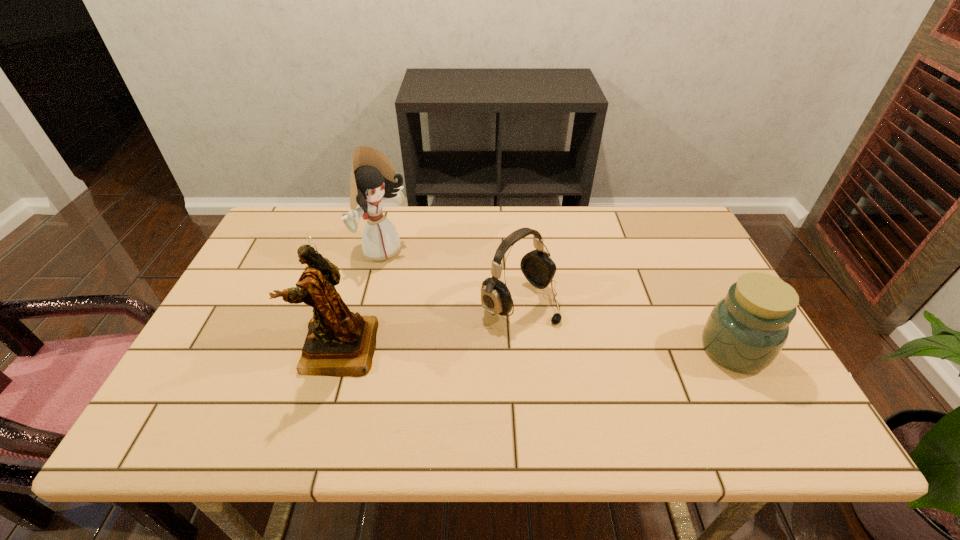
Identify the location of vacant region located at the front face of the doll. The image size is (960, 540). (416, 273).

Find the location of `vacant space located with the microphone on the side of the headset`. vacant space located with the microphone on the side of the headset is located at coordinates (564, 333).

Locate an element on the screen. Image resolution: width=960 pixels, height=540 pixels. blank area located 0.250m with the microphone on the side of the headset is located at coordinates (633, 385).

You are a GUI agent. You are given a task and a screenshot of the screen. Output one action in this format:
    pyautogui.click(x=<x>, y=<y>)
    Task: Click on the free space located with the microphone on the side of the headset
    Image resolution: width=960 pixels, height=540 pixels.
    Given the screenshot: What is the action you would take?
    pyautogui.click(x=625, y=379)

Locate an element on the screen. object at the far edge is located at coordinates (373, 179).

Where is `figurine that is at the near edge`? This screenshot has height=540, width=960. figurine that is at the near edge is located at coordinates (340, 343).

Locate an element on the screen. Image resolution: width=960 pixels, height=540 pixels. jar present at the near edge is located at coordinates (746, 330).

Locate an element on the screen. This screenshot has height=540, width=960. object positioned at the right edge is located at coordinates (746, 330).

I want to click on object that is at the near right corner, so click(x=746, y=330).

Locate an element on the screen. vacant space at the far edge of the desktop is located at coordinates (397, 212).